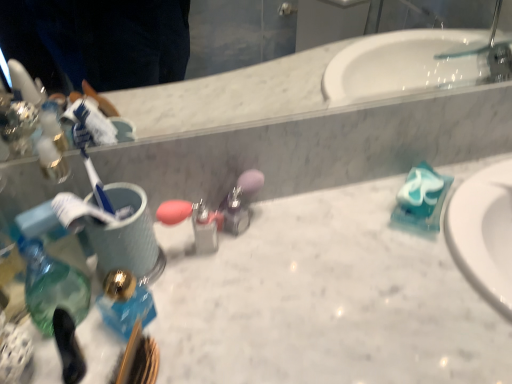
Question: Is white marble counter top at center situated inside translucent glass soap dispenser at left or outside?

Choices:
 (A) inside
 (B) outside

Answer: (B)

Question: From the image's perspective, relative to translucent glass soap dispenser at left, is white marble counter top at center above or below?

Choices:
 (A) above
 (B) below

Answer: (B)

Question: In the image, is white marble counter top at center positioned in front of or behind translucent glass soap dispenser at left?

Choices:
 (A) behind
 (B) front

Answer: (B)

Question: From a real-world perspective, is translucent glass soap dispenser at left positioned above or below white marble counter top at center?

Choices:
 (A) above
 (B) below

Answer: (A)

Question: Looking at the image, does translucent glass soap dispenser at left seem bigger or smaller compared to white marble counter top at center?

Choices:
 (A) big
 (B) small

Answer: (B)

Question: Would you say translucent glass soap dispenser at left is to the left or to the right of white marble counter top at center in the picture?

Choices:
 (A) right
 (B) left

Answer: (B)

Question: In terms of width, does translucent glass soap dispenser at left look wider or thinner when compared to white marble counter top at center?

Choices:
 (A) thin
 (B) wide

Answer: (A)